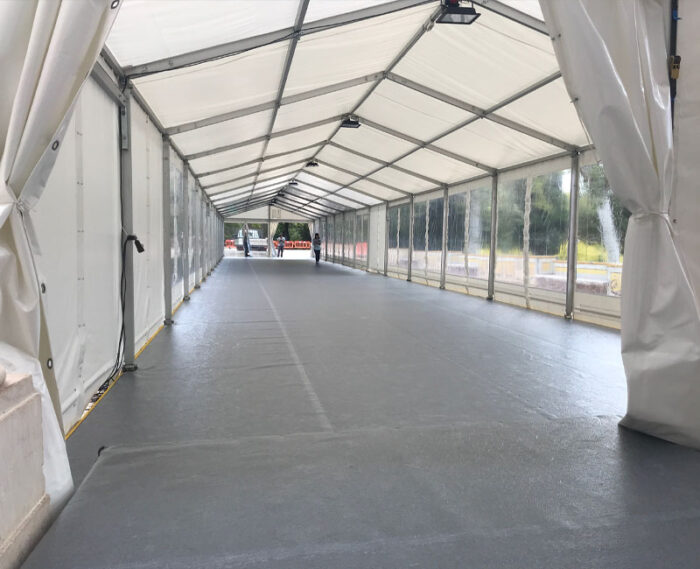
Locate an element on the screen. Image resolution: width=700 pixels, height=569 pixels. entrance/exit is located at coordinates (256, 233), (295, 232).